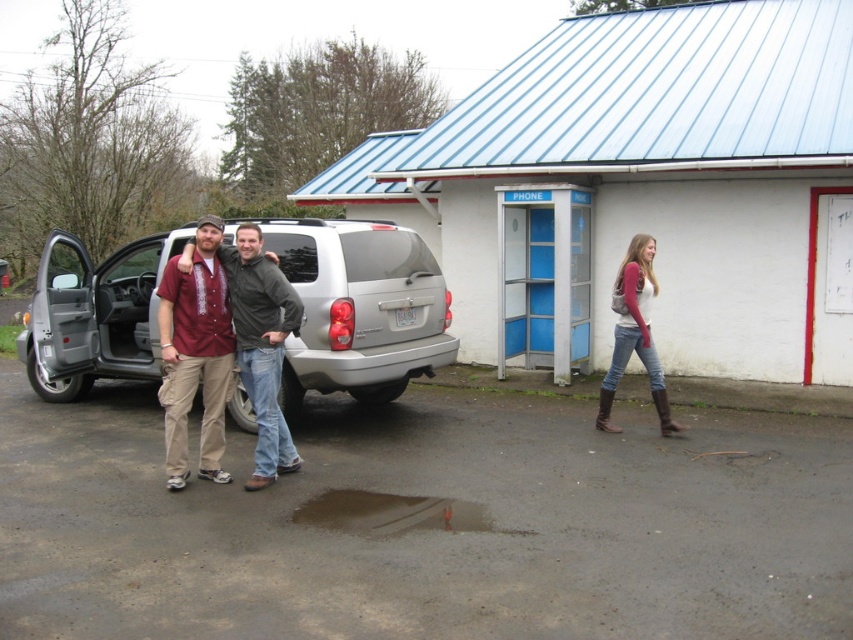
Which of these two, silver metallic suv at center or brown matte puddle at lower center, stands shorter?

With less height is brown matte puddle at lower center.

Who is higher up, silver metallic suv at center or brown matte puddle at lower center?

silver metallic suv at center

Locate an element on the screen. This screenshot has width=853, height=640. silver metallic suv at center is located at coordinates click(358, 308).

Identify the location of silver metallic suv at center. (358, 308).

Which is in front, point (177, 412) or point (306, 522)?

Point (306, 522)

Is matte red shirt at center to the left of brown matte puddle at lower center from the viewer's perspective?

Yes, matte red shirt at center is to the left of brown matte puddle at lower center.

The width and height of the screenshot is (853, 640). What are the coordinates of `matte red shirt at center` in the screenshot? It's located at (195, 355).

This screenshot has width=853, height=640. Identify the location of matte red shirt at center. (195, 355).

Can you confirm if silver metallic suv at center is positioned to the left of matte red shirt at center?

Yes, silver metallic suv at center is to the left of matte red shirt at center.

Is point (77, 252) closer to camera compared to point (224, 365)?

No.

Locate an element on the screen. This screenshot has width=853, height=640. silver metallic suv at center is located at coordinates (358, 308).